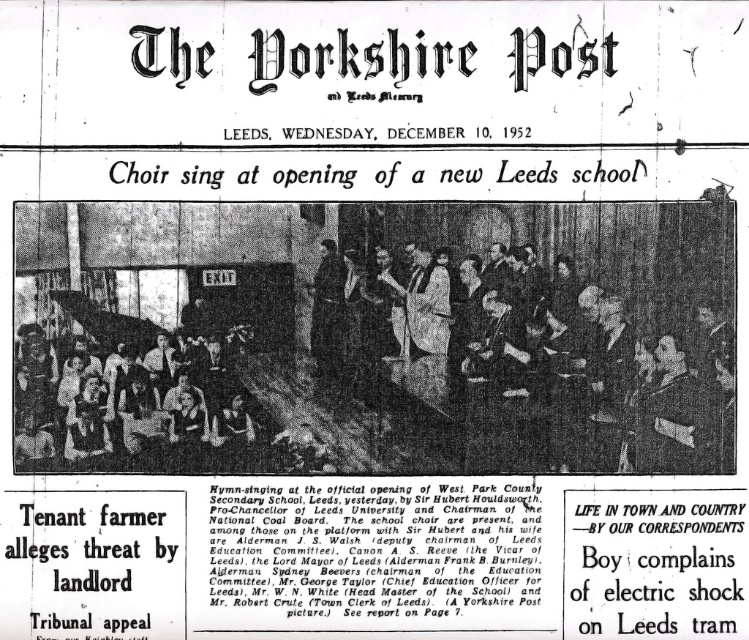
In the scene shown: Based on the scene described in the newspaper clipping, which object is taller between the dark suit coat at center and the matte black dress at lower left?

The dark suit coat at center is taller than the matte black dress at lower left.

You are a photographer who needs to capture a closeup shot of the dark suit coat at center and the matte black dress at lower left. Which object should you zoom in on to ensure both are in frame without moving the camera?

The dark suit coat at center is larger in size than the matte black dress at lower left, so you should zoom in on the dark suit coat at center to ensure both are in frame without moving the camera.

You are standing in the room where the choir is singing. There are two points marked on the floor at coordinates point (437, 256) and point (97, 337). If you want to move closer to the choir, which point should you step on?

You should step on point (437, 256) because it is closer to the viewer, meaning it is nearer to your current position in the room. Since the choir is likely performing at the front where people are gathered, moving towards the closer point would bring you nearer to them.